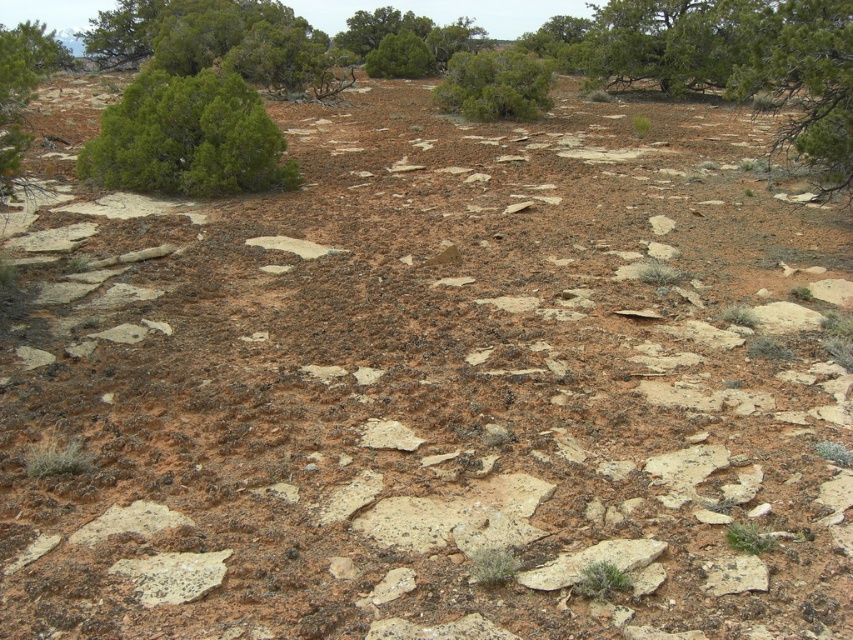
You are a hiker navigating the dry, arid landscape shown. You need to find the green leafy tree at upper right for shade. Which direction should you head from the green leafy bush at upper left?

The green leafy bush at upper left is to the left of the green leafy tree at upper right. Therefore, to reach the tree from the bush, you should head to the right.

You are navigating a terrain with two points marked on your map. The first point is at coordinates point (190, 112) and the second is at point (375, 68). Given the landscape described, which point is closer to your current position if you are standing at the starting point?

Point (190, 112) is closer to the viewer than point (375, 68), so the first point is closer to your current position.